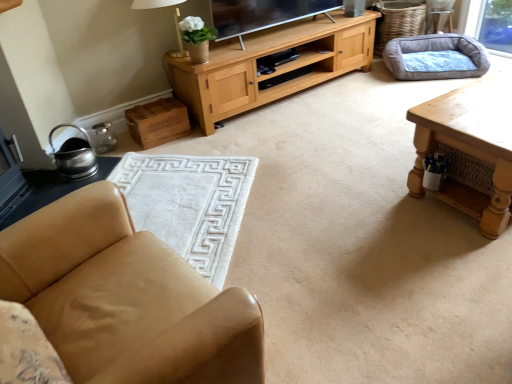
What are the coordinates of `vacant area that lies between wooden table at right and tan leather chair at lower left` in the screenshot? It's located at (353, 264).